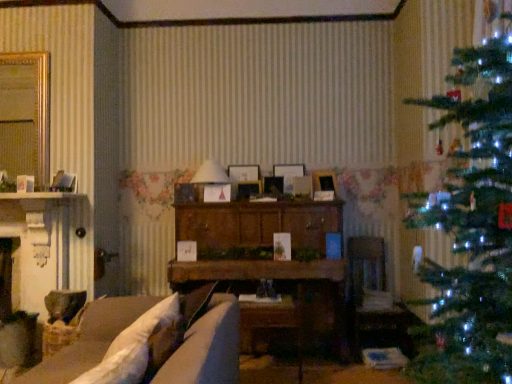
Question: Is gold metallic mirror at upper left situated inside wooden cabinet at center or outside?

Choices:
 (A) outside
 (B) inside

Answer: (A)

Question: Looking at their shapes, would you say gold metallic mirror at upper left is wider or thinner than wooden cabinet at center?

Choices:
 (A) wide
 (B) thin

Answer: (B)

Question: Which object is the closest to the wooden picture frame at center, placed as the fourth picture frame when sorted from left to right?

Choices:
 (A) green matte christmas tree at right
 (B) gold metallic mirror at upper left
 (C) velvet brown armchair at center
 (D) white paper lampshade at center
 (E) wooden picture frame at center, the 4th picture frame when ordered from right to left

Answer: (E)

Question: Considering the real-world distances, which object is closest to the white soft pillow at lower left?

Choices:
 (A) wooden picture frame at center, which ranks as the fifth picture frame in right-to-left order
 (B) wooden picture frame at center, positioned as the 3th picture frame in left-to-right order
 (C) wooden cabinet at center
 (D) matte white picture frame at center, which is the 5th picture frame from left to right
 (E) gold metallic mirror at upper left

Answer: (C)